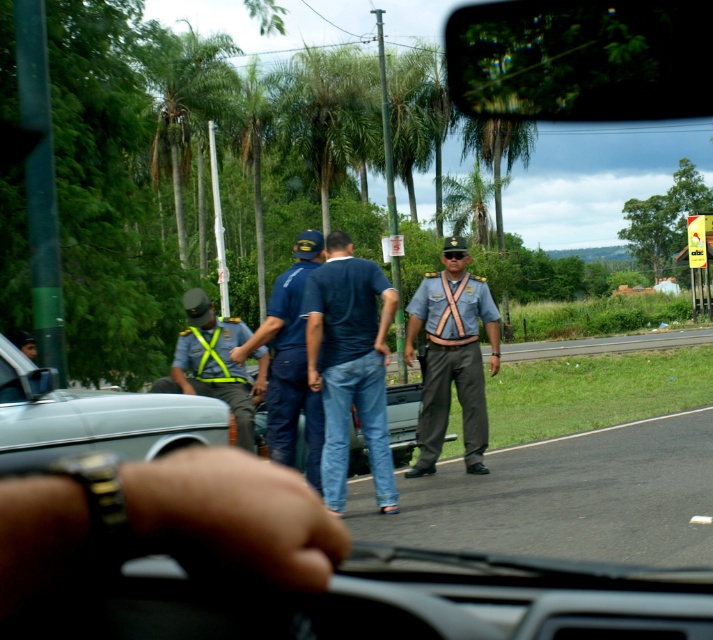
You are driving and notice a gray uniformed officer at center. Based on their position relative to the dashboard and windshield wiper, can you estimate whether the officer is in front of or behind the vehicle you are driving?

The gray uniformed officer at center is located at point [451,355], which places them in front of the vehicle since the coordinates suggest they are positioned outside the driver side, closer to the midground where the interaction with pedestrians occurs.

Consider the image. You are driving and want to check if you can safely see the dark blue jeans at center in your rearview mirror. The mirror has a 5 meter range. Can you see them?

The dark blue jeans at center are 7.67 meters away from you, which is beyond the 5 meter range of your rearview mirror. Therefore, you cannot see them in the mirror.